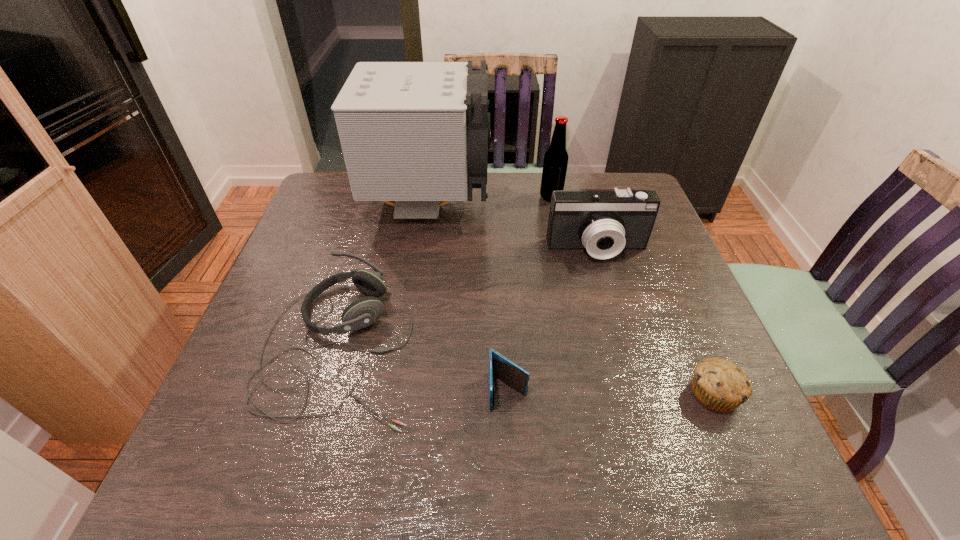
Find the location of a particular element. The width and height of the screenshot is (960, 540). free space between the wallet and the third tallest object is located at coordinates (553, 320).

The image size is (960, 540). I want to click on free spot between the headset and the beer bottle, so click(446, 271).

Identify which object is the second nearest to the camcorder. Please provide its 2D coordinates. Your answer should be formatted as a tuple, i.e. [(x, y)], where the tuple contains the x and y coordinates of a point satisfying the conditions above.

[(555, 163)]

Choose which object is the fifth nearest neighbor to the third tallest object. Please provide its 2D coordinates. Your answer should be formatted as a tuple, i.e. [(x, y)], where the tuple contains the x and y coordinates of a point satisfying the conditions above.

[(508, 372)]

Where is `free space that satisfies the following two spatial constraints: 1. on the exterior surface of the muffin; 2. on the right side of the wallet`? free space that satisfies the following two spatial constraints: 1. on the exterior surface of the muffin; 2. on the right side of the wallet is located at coordinates (508, 394).

Where is `free point that satisfies the following two spatial constraints: 1. on the front side of the fan; 2. on the right side of the muffin`? Image resolution: width=960 pixels, height=540 pixels. free point that satisfies the following two spatial constraints: 1. on the front side of the fan; 2. on the right side of the muffin is located at coordinates (402, 394).

Image resolution: width=960 pixels, height=540 pixels. I want to click on vacant space that satisfies the following two spatial constraints: 1. on the front side of the muffin; 2. on the left side of the fifth shortest object, so click(x=591, y=394).